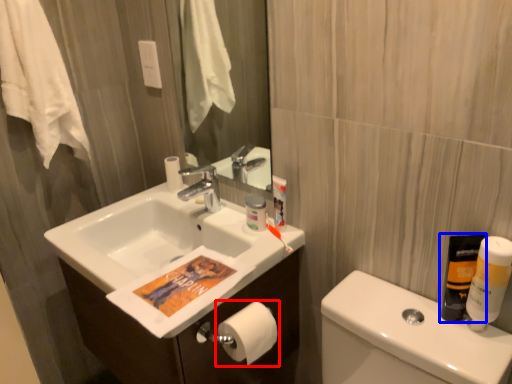
Question: Among these objects, which one is nearest to the camera, toilet paper (highlighted by a red box) or mouthwash (highlighted by a blue box)?

Choices:
 (A) toilet paper
 (B) mouthwash

Answer: (B)